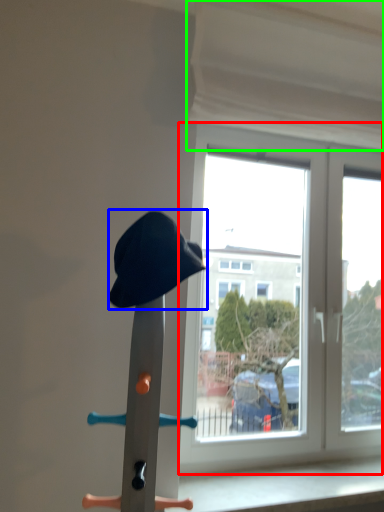
Question: Based on their relative distances, which object is farther from window (highlighted by a red box)? Choose from hat (highlighted by a blue box) and curtain (highlighted by a green box).

Choices:
 (A) hat
 (B) curtain

Answer: (A)